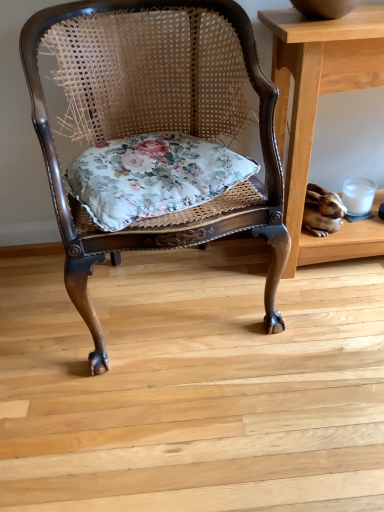
At what (x,y) coordinates should I click in order to perform the action: click on free space on the front side of rattan chair with floral cushion at center. Please return your answer as a coordinate pair (x, y). The width and height of the screenshot is (384, 512). Looking at the image, I should click on (183, 421).